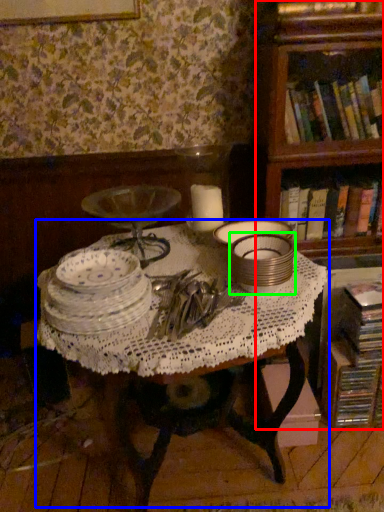
Question: Which object is positioned farthest from bookcase (highlighted by a red box)? Select from table (highlighted by a blue box) and tableware (highlighted by a green box).

Choices:
 (A) table
 (B) tableware

Answer: (A)